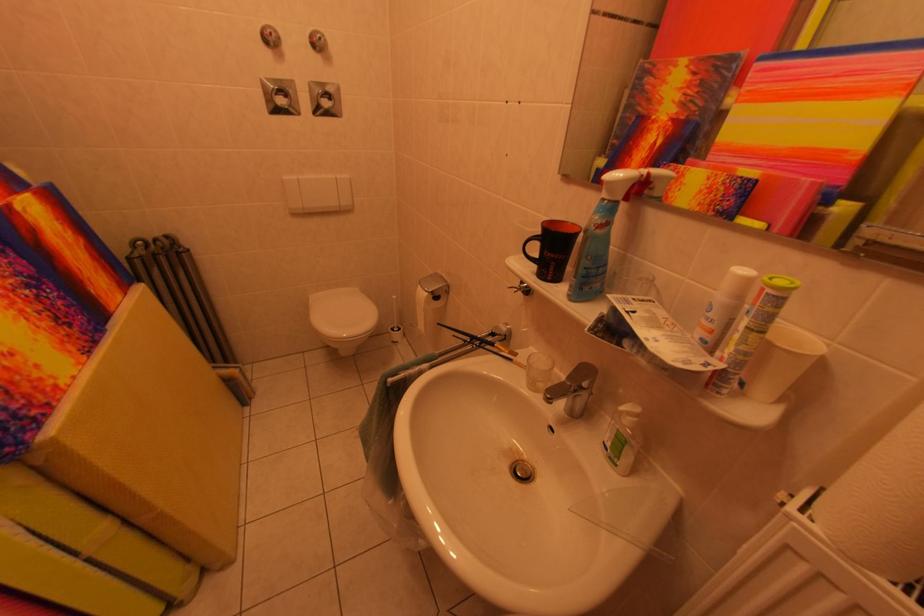
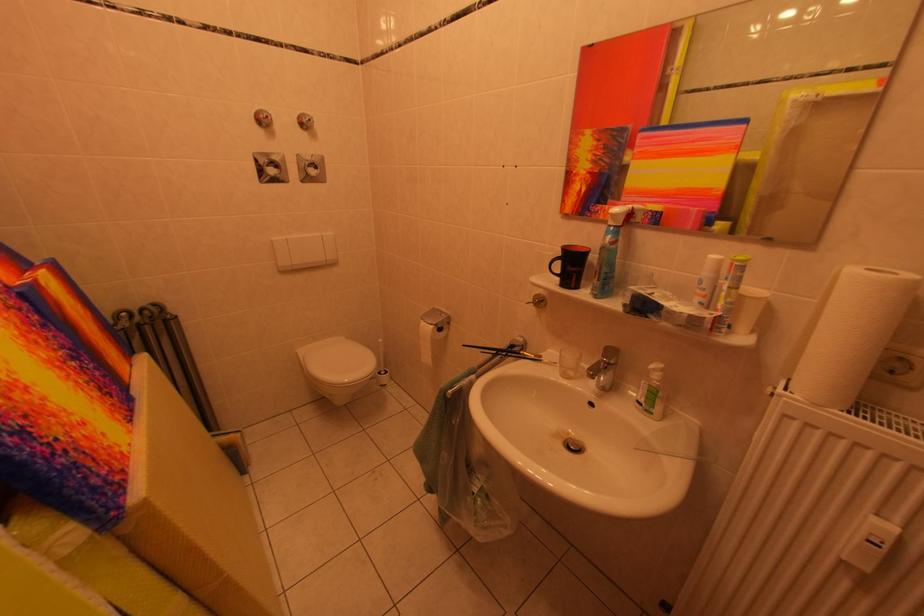
Find the pixel in the second image that matches the point at 289,106 in the first image.

(282, 175)